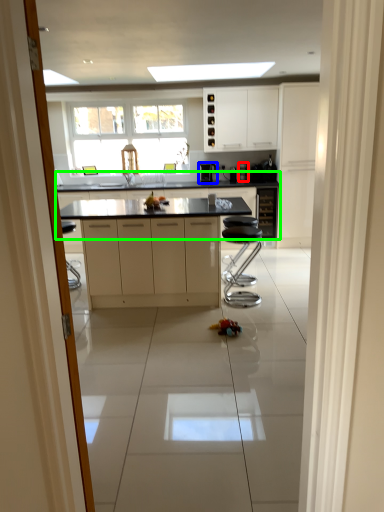
Question: Which object is positioned closest to coffee machine (highlighted by a red box)? Select from coffee machine (highlighted by a blue box) and countertop (highlighted by a green box).

Choices:
 (A) coffee machine
 (B) countertop

Answer: (A)